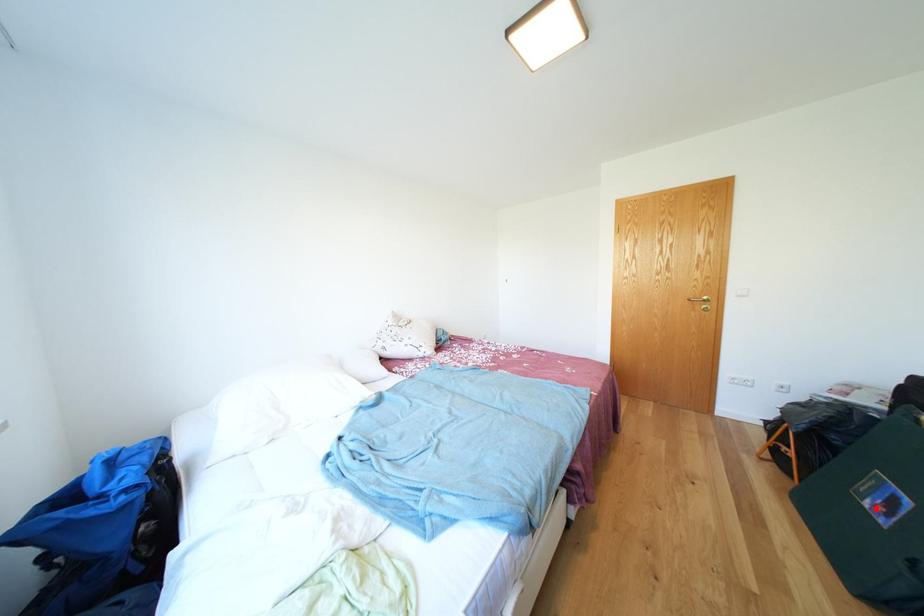
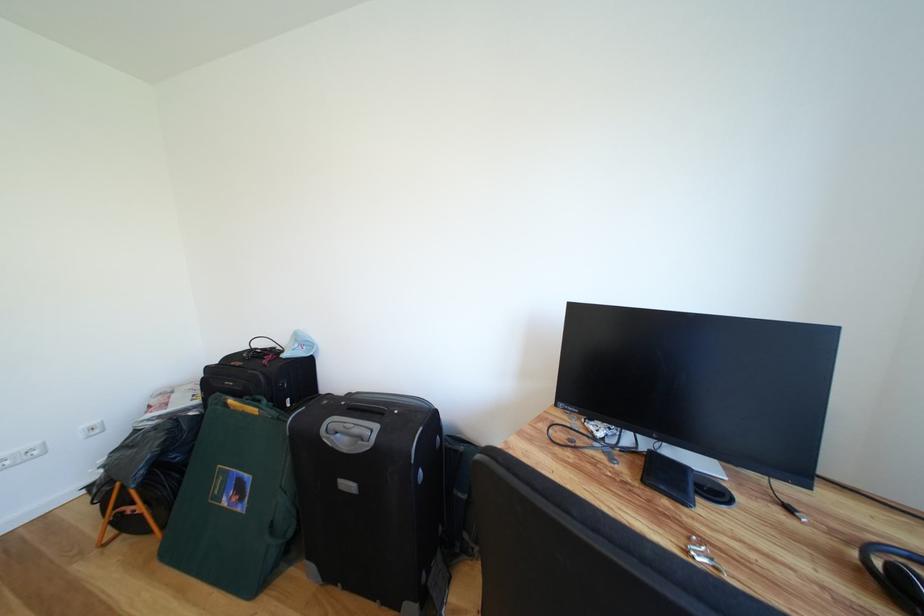
Question: I am providing you with two images of the same scene from different viewpoints. Image1 has a red point marked. In image2, the corresponding 3D location appears at what relative position? Reply with the corresponding letter.

Choices:
 (A) Closer
 (B) Farther

Answer: (A)